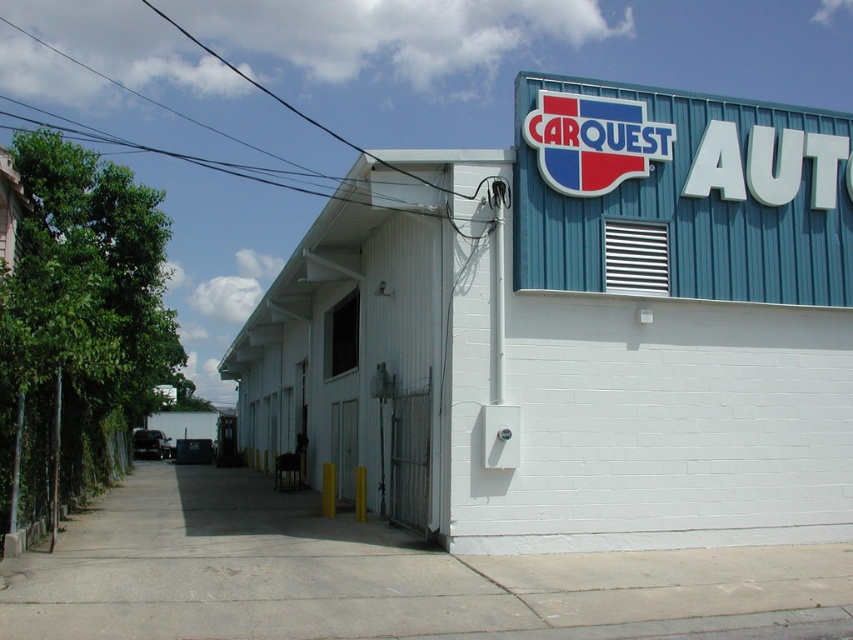
You are a delivery driver who needs to locate the entrance to the Carquest Auto Parts store. The entrance is typically found on the lower part of the building. Based on the image provided, where should you look for the entrance relative to the white brick building at center?

The entrance to the Carquest Auto Parts store is located on the lower part of the building, which corresponds to the area below the white brick building at center. Since the white brick building at center is positioned at coordinates approximately 0.512 on the x and 0.679 on the y axis, the entrance would be found below this location.

You are a delivery driver arriving at the Carquest Auto Parts store. You need to determine which object is larger between the white brick building at center and the blue corrugated metal sign at upper right. Which one is larger?

The white brick building at center is bigger than the blue corrugated metal sign at upper right according to the description.

You are standing at the entrance of the Carquest Auto Parts store and see two points marked on the building. One is at point coordinates point (380, 413) and the other is at point (613, 196). Which point is closer to the entrance?

Point (613, 196) is closer to the entrance because it is in front of point (380, 413), which is behind it.